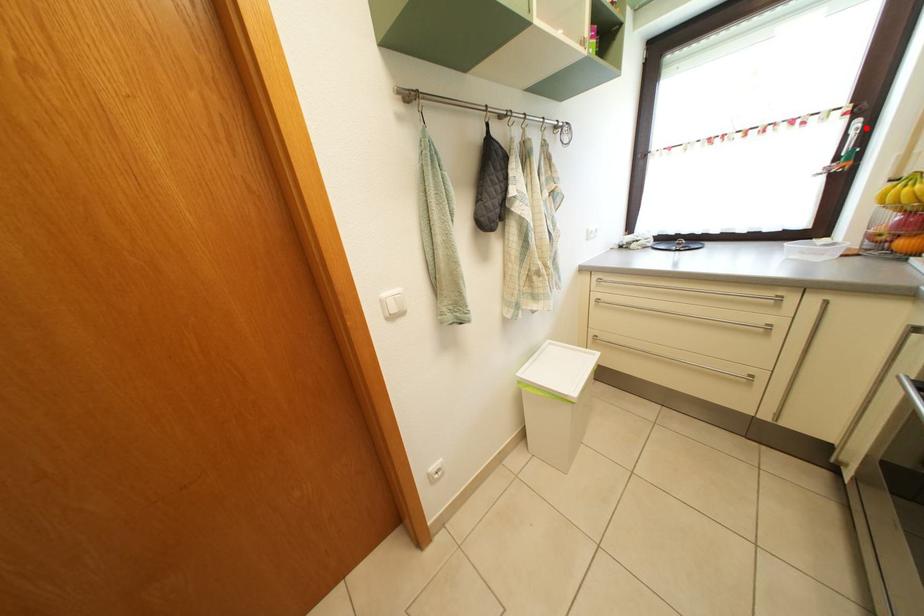
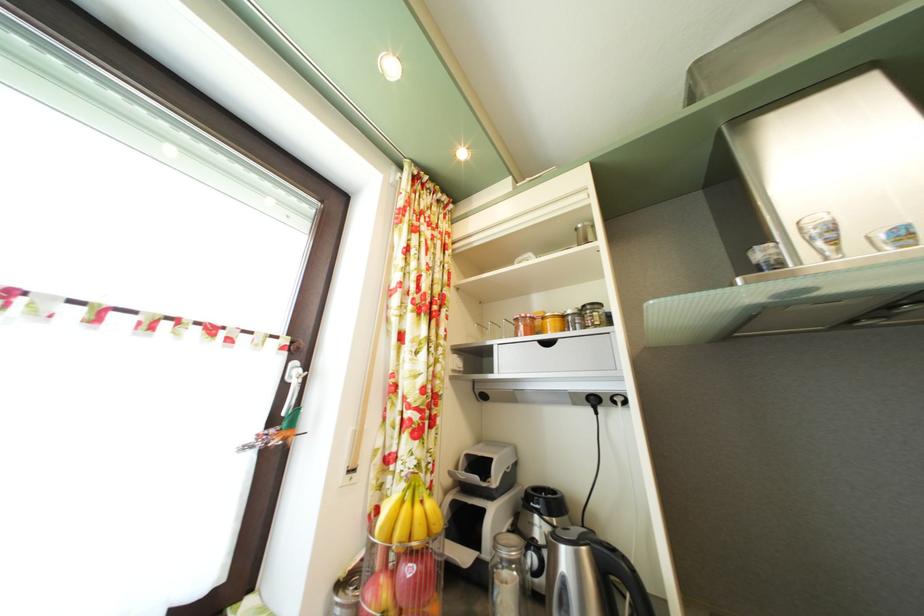
Find the pixel in the second image that matches the highlighted location in the first image.

(304, 371)